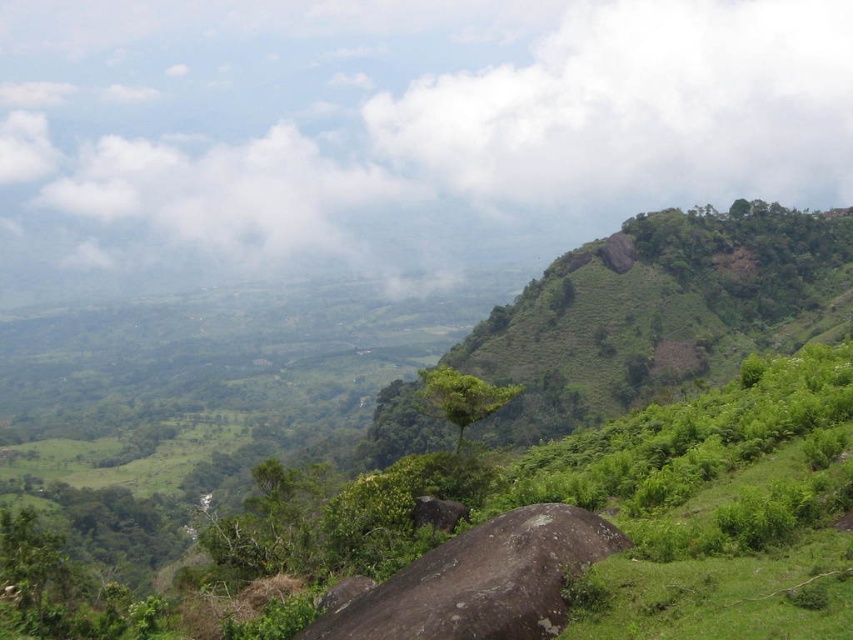
Consider the image. You are standing at the top of the hill looking down at the gray rough boulder at center and the green leafy tree at center. Which object is higher in elevation?

The gray rough boulder at center is higher in elevation than the green leafy tree at center because it is positioned above it in the scene.

You are standing at the edge of a cliff overlooking the landscape. You see the gray rough boulder at center and the green leafy tree at center. Which object is closer to you?

The gray rough boulder at center is closer to the viewer than the green leafy tree at center.

You are standing at the viewpoint overlooking the landscape and want to determine the relative positions of two points marked in the scene. Which of the two points, point 1 at coordinates point (x=610, y=524) or point 2 at coordinates point (x=421, y=401), is closer to your current position?

Point 1 at coordinates point (x=610, y=524) is closer to your current position because it is closer to the camera than point 2 at coordinates point (x=421, y=401).